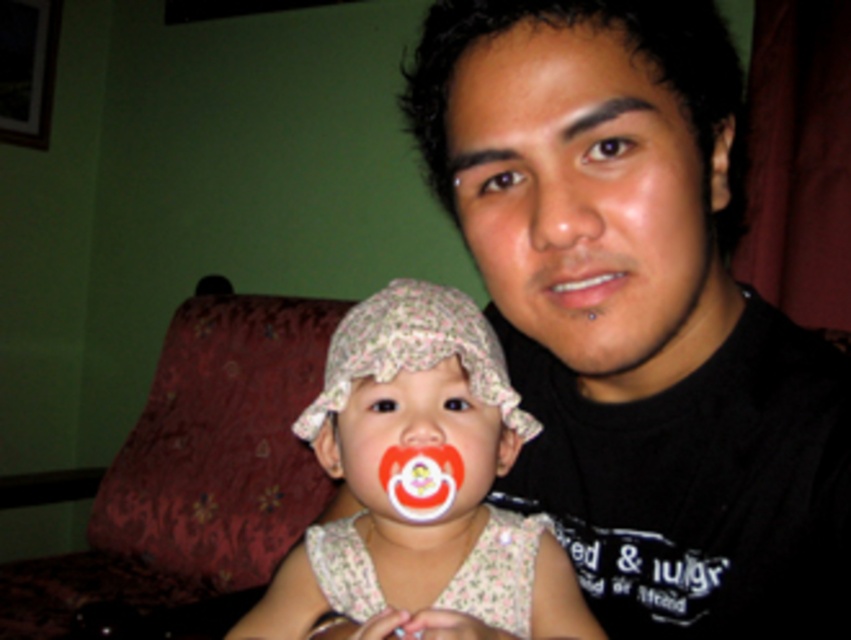
Locate an element on the screen. floral fabric baby hat at center is located at coordinates (420, 486).

Who is shorter, floral fabric baby hat at center or matte skin nose at center?

With less height is matte skin nose at center.

Find the location of a particular element. The width and height of the screenshot is (851, 640). floral fabric baby hat at center is located at coordinates (420, 486).

Does matte black shirt at center appear on the right side of matte plastic pacifier at center?

Correct, you'll find matte black shirt at center to the right of matte plastic pacifier at center.

Does matte black shirt at center appear on the left side of matte plastic pacifier at center?

In fact, matte black shirt at center is to the right of matte plastic pacifier at center.

Which is behind, point (681, 310) or point (438, 410)?

The point (438, 410) is behind.

The width and height of the screenshot is (851, 640). Find the location of `matte black shirt at center`. matte black shirt at center is located at coordinates (644, 321).

Is floral fabric baby hat at center positioned behind matte plastic pacifier at center?

No, it is not.

Is point (469, 588) behind point (443, 416)?

That is True.

The width and height of the screenshot is (851, 640). What are the coordinates of `floral fabric baby hat at center` in the screenshot? It's located at (420, 486).